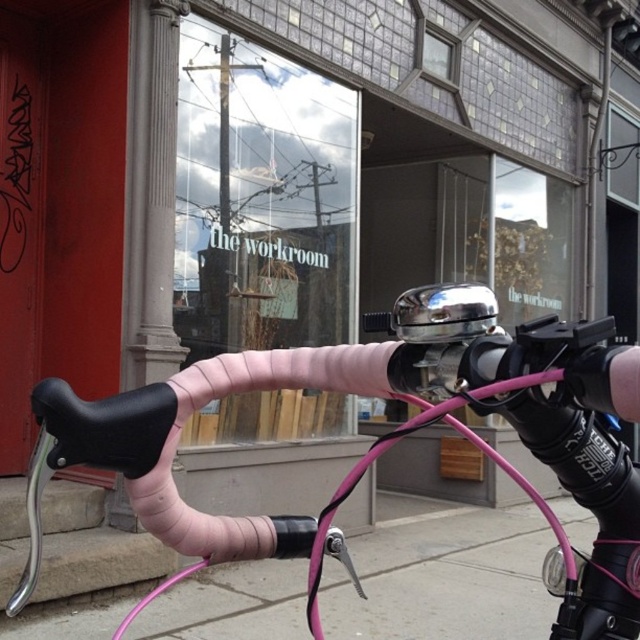
You are standing in front of a bicycle and a storefront. You notice two points marked on the image. One is at coordinate point (208, 525) and the other at point (154, 637). From your perspective, which point is closer to you?

Point (208, 525) is in front of point (154, 637), so it is closer to you.

You are a cyclist trying to adjust your bike setup. You have the pink matte handlebars at center and the pink rubber handlebar at lower center in your view. Which handlebar is located to the right?

The pink rubber handlebar at lower center is located to the right because the pink matte handlebars at center is positioned on its left side.

You are standing in front of a bicycle and want to reach a point on the handlebars marked as point (177, 392). If your arm can extend 1 meter, can you reach it?

The point (177, 392) is 1.03 meters away from you, so your arm can only extend 1 meter. You cannot reach it.